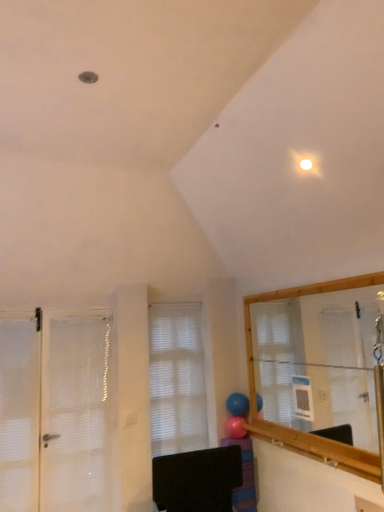
Question: Does white matte window at center have a greater width compared to pink rubber balloon at center, which ranks as the 2th balloon in top-to-bottom order?

Choices:
 (A) yes
 (B) no

Answer: (B)

Question: From the image's perspective, is white matte window at center located beneath pink rubber balloon at center, which is counted as the first balloon, starting from the bottom?

Choices:
 (A) no
 (B) yes

Answer: (A)

Question: Considering the relative sizes of white matte window at center and pink rubber balloon at center, which ranks as the 2th balloon in top-to-bottom order, in the image provided, is white matte window at center thinner than pink rubber balloon at center, which ranks as the 2th balloon in top-to-bottom order,?

Choices:
 (A) no
 (B) yes

Answer: (B)

Question: Does white matte window at center lie behind pink rubber balloon at center, which is counted as the first balloon, starting from the bottom?

Choices:
 (A) no
 (B) yes

Answer: (A)

Question: Is white matte window at center not close to pink rubber balloon at center, which ranks as the 2th balloon in top-to-bottom order?

Choices:
 (A) no
 (B) yes

Answer: (A)

Question: From their relative heights in the image, would you say purple striped socks at lower center is taller or shorter than rubber blue balloon at center, which is the 1th balloon from top to bottom?

Choices:
 (A) tall
 (B) short

Answer: (A)

Question: Considering the relative positions of purple striped socks at lower center and rubber blue balloon at center, which is the second balloon in bottom-to-top order, in the image provided, is purple striped socks at lower center to the left or to the right of rubber blue balloon at center, which is the second balloon in bottom-to-top order,?

Choices:
 (A) right
 (B) left

Answer: (A)

Question: Considering the positions of purple striped socks at lower center and rubber blue balloon at center, which is the 1th balloon from top to bottom, in the image, is purple striped socks at lower center wider or thinner than rubber blue balloon at center, which is the 1th balloon from top to bottom,?

Choices:
 (A) thin
 (B) wide

Answer: (B)

Question: Is purple striped socks at lower center in front of or behind rubber blue balloon at center, which is the second balloon in bottom-to-top order, in the image?

Choices:
 (A) behind
 (B) front

Answer: (B)

Question: Would you say purple striped socks at lower center is inside or outside pink rubber balloon at center, which ranks as the 2th balloon in top-to-bottom order?

Choices:
 (A) inside
 (B) outside

Answer: (B)

Question: Considering the positions of purple striped socks at lower center and pink rubber balloon at center, which ranks as the 2th balloon in top-to-bottom order, in the image, is purple striped socks at lower center wider or thinner than pink rubber balloon at center, which ranks as the 2th balloon in top-to-bottom order,?

Choices:
 (A) wide
 (B) thin

Answer: (A)

Question: Is purple striped socks at lower center to the left or to the right of pink rubber balloon at center, which ranks as the 2th balloon in top-to-bottom order, in the image?

Choices:
 (A) left
 (B) right

Answer: (B)

Question: Is purple striped socks at lower center bigger or smaller than pink rubber balloon at center, which ranks as the 2th balloon in top-to-bottom order?

Choices:
 (A) small
 (B) big

Answer: (B)

Question: From a real-world perspective, relative to rubber blue balloon at center, which is the second balloon in bottom-to-top order, is white matte window at center vertically above or below?

Choices:
 (A) below
 (B) above

Answer: (B)

Question: In terms of width, does white matte window at center look wider or thinner when compared to rubber blue balloon at center, which is the second balloon in bottom-to-top order?

Choices:
 (A) wide
 (B) thin

Answer: (B)